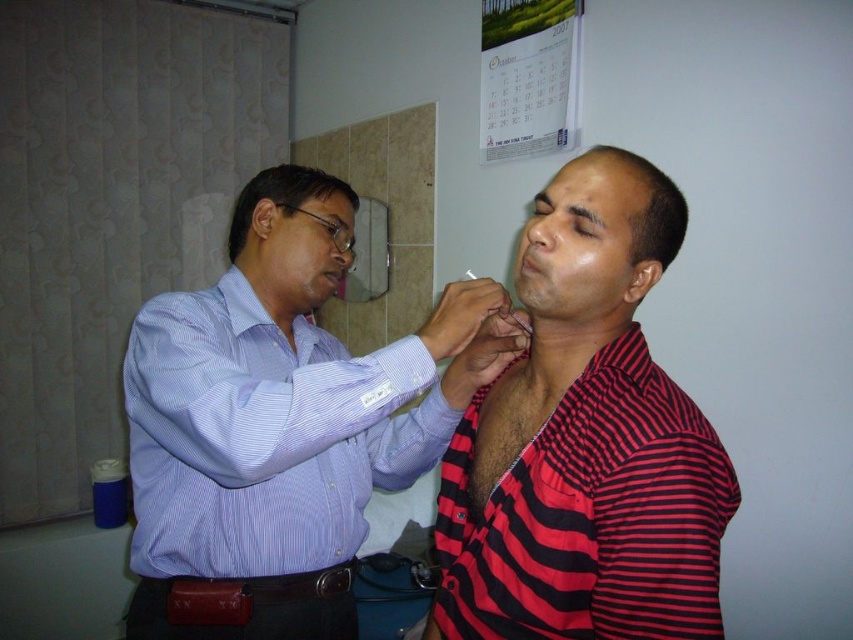
Which of these two, blue striped shirt at upper left or red striped shirt at center, stands shorter?

Standing shorter between the two is red striped shirt at center.

Who is lower down, blue striped shirt at upper left or red striped shirt at center?

blue striped shirt at upper left

Between point (146, 424) and point (675, 196), which one is positioned in front?

Positioned in front is point (675, 196).

This screenshot has height=640, width=853. Identify the location of blue striped shirt at upper left. (282, 420).